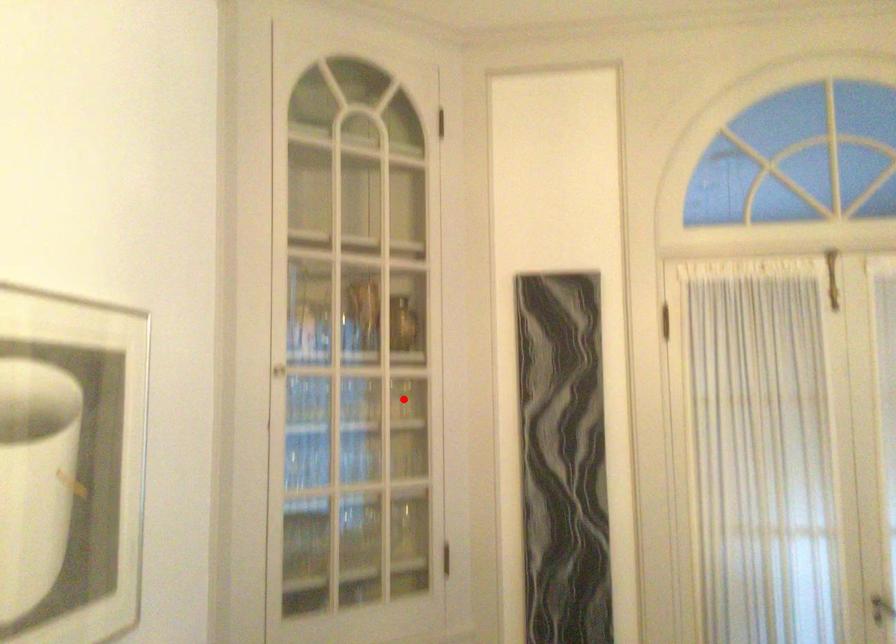
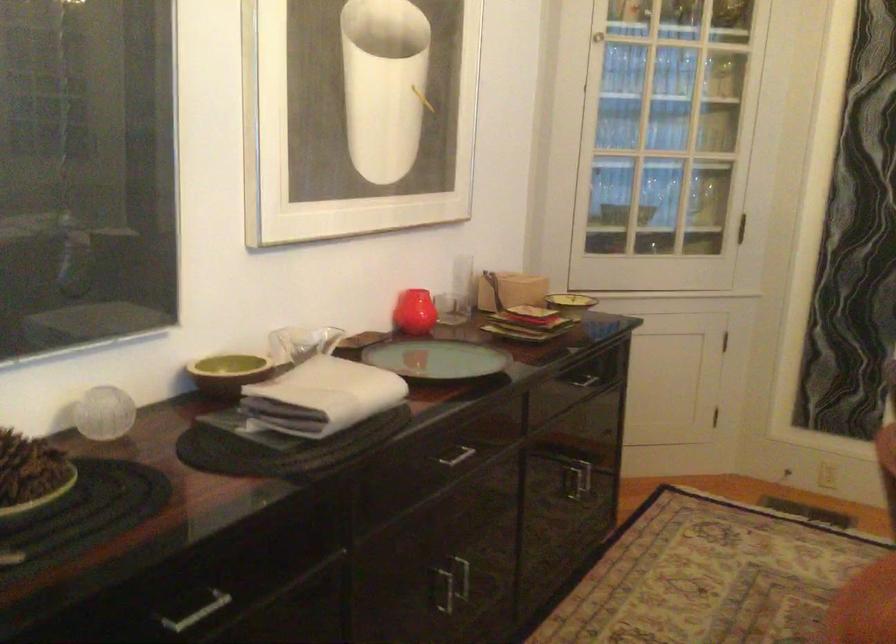
Where in the second image is the point corresponding to the highlighted location from the first image?

(721, 77)